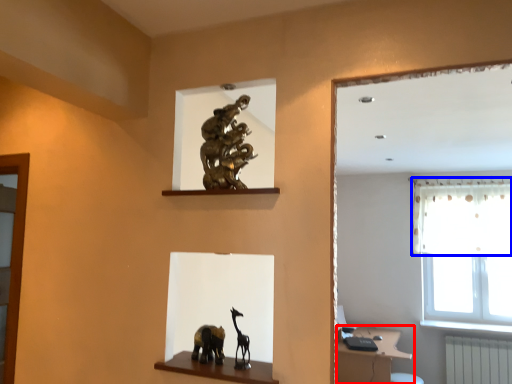
Question: Which point is closer to the camera, vanity (highlighted by a red box) or curtain (highlighted by a blue box)?

Choices:
 (A) vanity
 (B) curtain

Answer: (A)